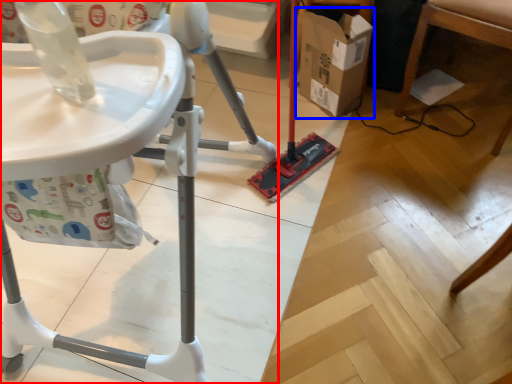
Question: Which object appears closest to the camera in this image, furniture (highlighted by a red box) or cardboard box (highlighted by a blue box)?

Choices:
 (A) furniture
 (B) cardboard box

Answer: (A)